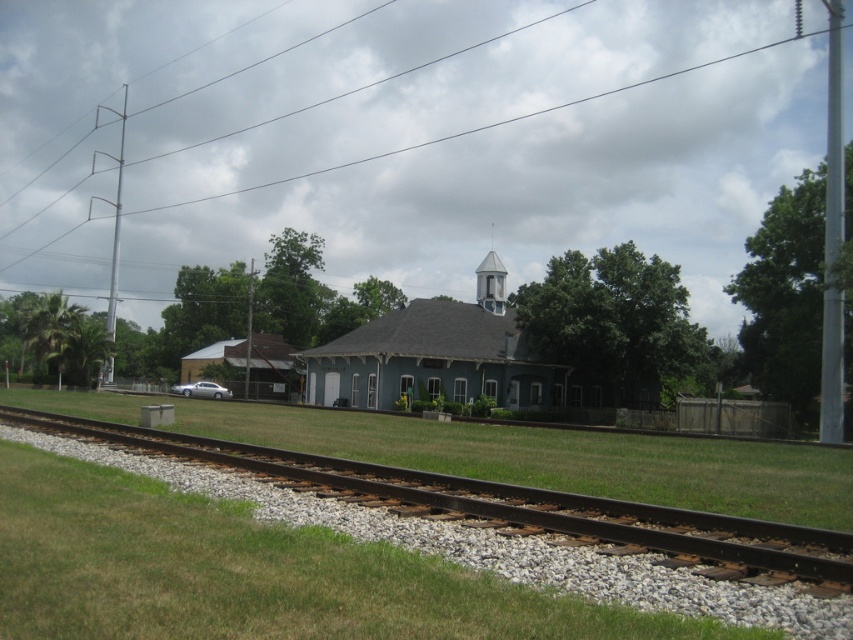
Which of these two, brown gravel track at lower left or light blue wood church at center, stands taller?

light blue wood church at center

Locate an element on the screen. brown gravel track at lower left is located at coordinates (514, 506).

Is point (509, 492) farther from camera compared to point (531, 365)?

That is False.

At what (x,y) coordinates should I click in order to perform the action: click on brown gravel track at lower left. Please return your answer as a coordinate pair (x, y). Looking at the image, I should click on (514, 506).

Measure the distance from light blue wood church at center to white painted wood bell tower at upper center.

light blue wood church at center is 10.66 meters away from white painted wood bell tower at upper center.

Is point (364, 392) positioned after point (491, 253)?

No, (364, 392) is closer to viewer.

Find the location of a particular element. light blue wood church at center is located at coordinates (436, 355).

Measure the distance between brown gravel track at lower left and white painted wood bell tower at upper center.

brown gravel track at lower left is 48.87 meters away from white painted wood bell tower at upper center.

This screenshot has height=640, width=853. What are the coordinates of `brown gravel track at lower left` in the screenshot? It's located at (514, 506).

This screenshot has height=640, width=853. Identify the location of brown gravel track at lower left. (514, 506).